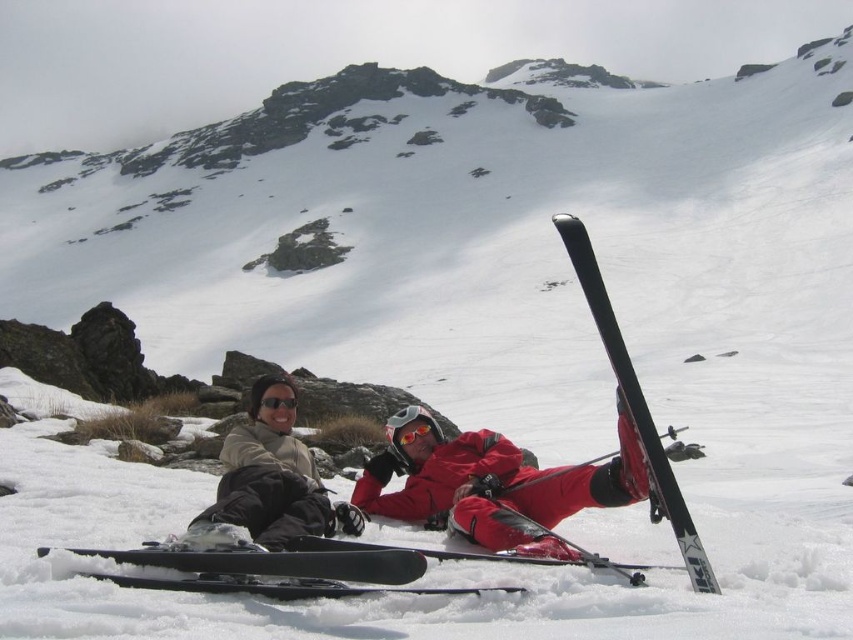
Is matte beige jacket at center closer to camera compared to black reflective goggles at center?

Yes.

Does matte beige jacket at center have a lesser width compared to black reflective goggles at center?

In fact, matte beige jacket at center might be wider than black reflective goggles at center.

Where is `matte beige jacket at center`? This screenshot has width=853, height=640. matte beige jacket at center is located at coordinates (271, 481).

Is the position of matte beige jacket at center less distant than that of black matte ski at center?

No, matte beige jacket at center is further to the viewer.

Measure the distance between matte beige jacket at center and camera.

The distance of matte beige jacket at center from camera is 120.55 feet.

Who is more forward, (248,518) or (637,419)?

Point (637,419) is in front.

Where is `matte beige jacket at center`? The image size is (853, 640). matte beige jacket at center is located at coordinates (271, 481).

Who is more forward, (x=206, y=534) or (x=421, y=429)?

Positioned in front is point (x=206, y=534).

Does point (335, 504) lie behind point (422, 426)?

No, (335, 504) is closer to viewer.

Identify the location of matte beige jacket at center. Image resolution: width=853 pixels, height=640 pixels. (271, 481).